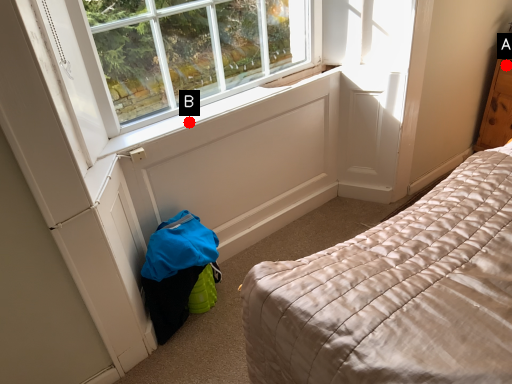
Question: Two points are circled on the image, labeled by A and B beside each circle. Among these points, which one is farthest from the camera?

Choices:
 (A) A is further
 (B) B is further

Answer: (A)